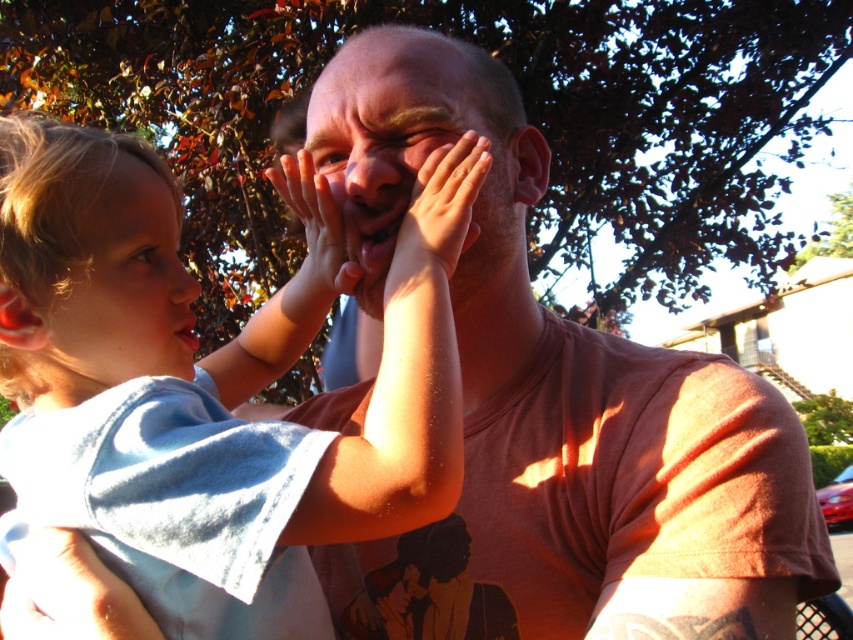
You are designing a photo frame that needs to accommodate both the light blue cotton shirt at left and the smooth skin face at center. Which object requires a larger space in the frame?

The light blue cotton shirt at left requires a larger space in the frame since it is bigger than the smooth skin face at center.

You are a photographer trying to capture a candid shot of the adult and child in the scene. You notice the smooth skin face at center and the blonde hair at left. Which object is located to the right of the other?

The smooth skin face at center is positioned on the right side of blonde hair at left, so the smooth skin face at center is to the right of the blonde hair at left.